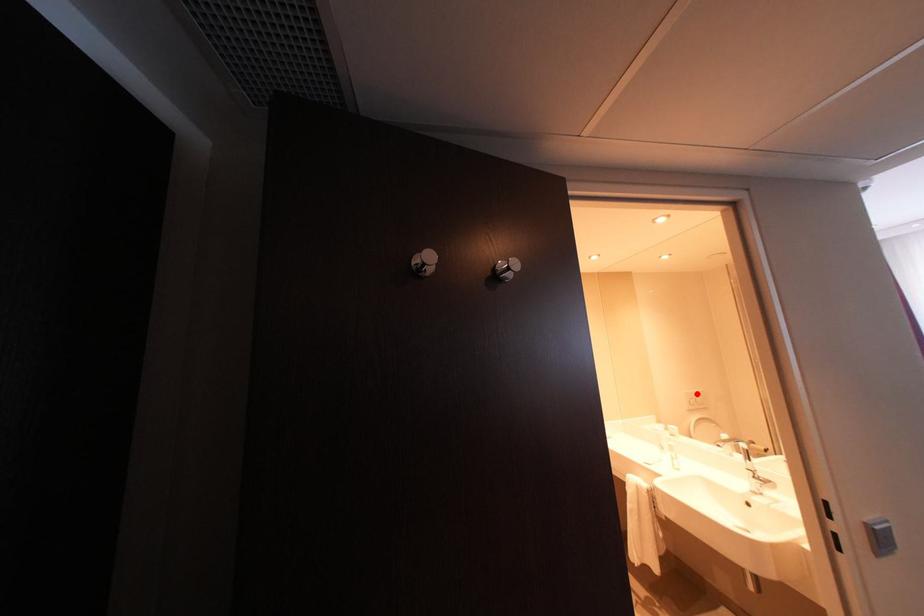
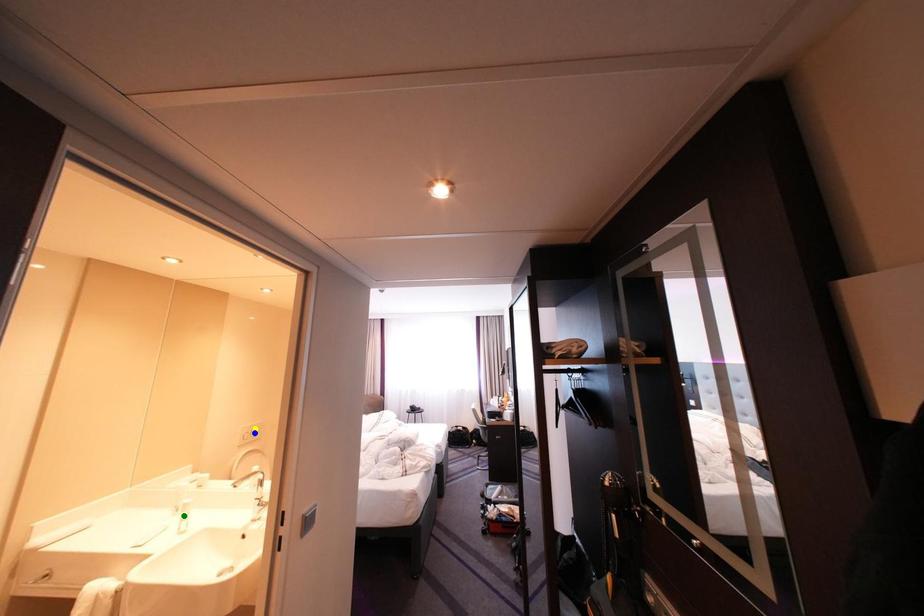
Question: I am providing you with two images of the same scene from different viewpoints. A red point is marked on the first image. You are given multiple points on the second image. Which point in image 2 is actually the same real-world point as the red point in image 1?

Choices:
 (A) yellow point
 (B) green point
 (C) blue point

Answer: (A)